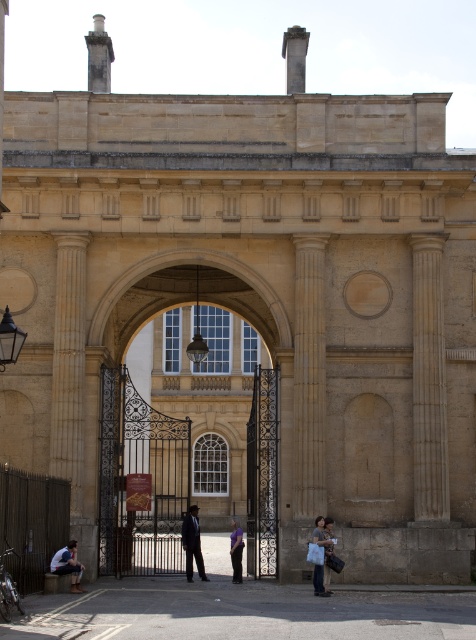
Question: Which point is closer to the camera?

Choices:
 (A) denim jacket at lower right
 (B) light blue denim jacket at lower left
 (C) dark blue jeans at center
 (D) dark blue suit at center

Answer: (B)

Question: Estimate the real-world distances between objects in this image. Which object is farther from the dark brown wrought iron gate at center?

Choices:
 (A) dark blue suit at center
 (B) denim jacket at lower right
 (C) smooth stone column at right

Answer: (B)

Question: Does dark brown wrought iron gate at center have a lesser width compared to dark blue jeans at center?

Choices:
 (A) no
 (B) yes

Answer: (A)

Question: Observing the image, what is the correct spatial positioning of denim jacket at lower right in reference to light brown leather jacket at lower right?

Choices:
 (A) left
 (B) right

Answer: (A)

Question: Can you confirm if smooth stone column at right is wider than light brown leather jacket at lower right?

Choices:
 (A) yes
 (B) no

Answer: (A)

Question: Which of the following is the farthest from the observer?

Choices:
 (A) (324, 589)
 (B) (426, 369)
 (C) (186, 554)

Answer: (C)